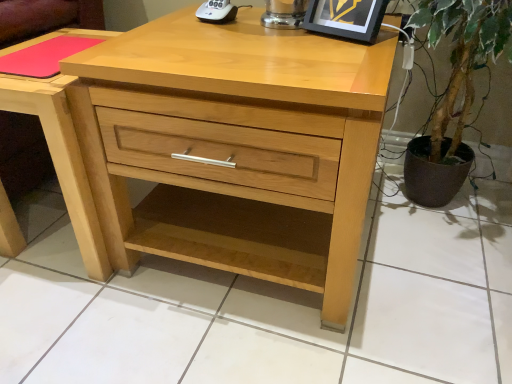
Question: Can matte black picture frame at upper right be found inside pink matte mousepad at upper left?

Choices:
 (A) yes
 (B) no

Answer: (B)

Question: Can you confirm if pink matte mousepad at upper left is positioned to the left of matte black picture frame at upper right?

Choices:
 (A) yes
 (B) no

Answer: (A)

Question: Is pink matte mousepad at upper left taller than matte black picture frame at upper right?

Choices:
 (A) no
 (B) yes

Answer: (A)

Question: Can you confirm if pink matte mousepad at upper left is bigger than matte black picture frame at upper right?

Choices:
 (A) yes
 (B) no

Answer: (B)

Question: Considering the relative sizes of pink matte mousepad at upper left and matte black picture frame at upper right in the image provided, is pink matte mousepad at upper left wider than matte black picture frame at upper right?

Choices:
 (A) yes
 (B) no

Answer: (A)

Question: From the image's perspective, is light wood nightstand at center positioned above or below white plastic remote control at upper center?

Choices:
 (A) below
 (B) above

Answer: (A)

Question: Is point (10, 109) positioned closer to the camera than point (208, 19)?

Choices:
 (A) farther
 (B) closer

Answer: (B)

Question: Considering the positions of light wood nightstand at center and white plastic remote control at upper center in the image, is light wood nightstand at center taller or shorter than white plastic remote control at upper center?

Choices:
 (A) short
 (B) tall

Answer: (B)

Question: Is light wood nightstand at center inside or outside of white plastic remote control at upper center?

Choices:
 (A) outside
 (B) inside

Answer: (A)

Question: Is natural wood chest of drawers at center in front of or behind matte black picture frame at upper right in the image?

Choices:
 (A) behind
 (B) front

Answer: (B)

Question: Considering the positions of point (167, 205) and point (357, 8), is point (167, 205) closer or farther from the camera than point (357, 8)?

Choices:
 (A) farther
 (B) closer

Answer: (A)

Question: From the image's perspective, is natural wood chest of drawers at center positioned above or below matte black picture frame at upper right?

Choices:
 (A) above
 (B) below

Answer: (B)

Question: In terms of size, does natural wood chest of drawers at center appear bigger or smaller than matte black picture frame at upper right?

Choices:
 (A) small
 (B) big

Answer: (B)

Question: Looking at their shapes, would you say pink matte mousepad at upper left is wider or thinner than matte black picture frame at upper right?

Choices:
 (A) thin
 (B) wide

Answer: (B)

Question: Considering the positions of pink matte mousepad at upper left and matte black picture frame at upper right in the image, is pink matte mousepad at upper left bigger or smaller than matte black picture frame at upper right?

Choices:
 (A) big
 (B) small

Answer: (B)